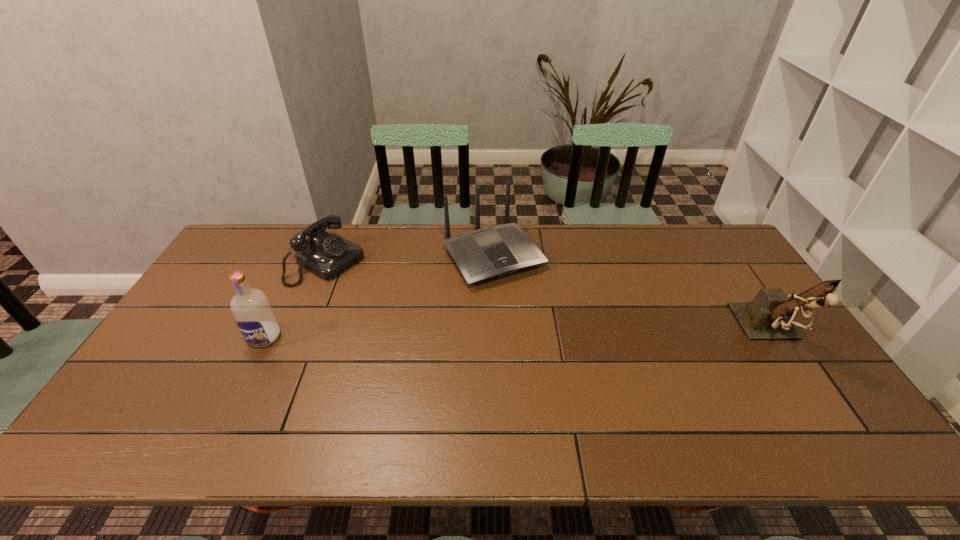
Image resolution: width=960 pixels, height=540 pixels. Identify the location of vacant space that is in between the router and the shortest object. (410, 260).

Identify the location of vacant space that's between the vodka and the shortest object. The width and height of the screenshot is (960, 540). (296, 300).

Point out which object is positioned as the third nearest to the router. Please provide its 2D coordinates. Your answer should be formatted as a tuple, i.e. [(x, y)], where the tuple contains the x and y coordinates of a point satisfying the conditions above.

[(769, 316)]

Locate which object is the third closest to the vodka. Please provide its 2D coordinates. Your answer should be formatted as a tuple, i.e. [(x, y)], where the tuple contains the x and y coordinates of a point satisfying the conditions above.

[(769, 316)]

I want to click on free spot that satisfies the following two spatial constraints: 1. on the back side of the third object from left to right; 2. on the left side of the telephone, so click(329, 256).

Where is `free space that satisfies the following two spatial constraints: 1. on the back side of the shortest object; 2. on the right side of the router`? The height and width of the screenshot is (540, 960). free space that satisfies the following two spatial constraints: 1. on the back side of the shortest object; 2. on the right side of the router is located at coordinates (329, 256).